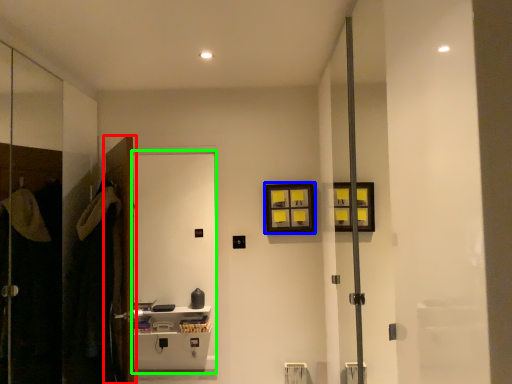
Question: Based on their relative distances, which object is farther from door (highlighted by a red box)? Choose from picture frame (highlighted by a blue box) and screen door (highlighted by a green box).

Choices:
 (A) picture frame
 (B) screen door

Answer: (B)